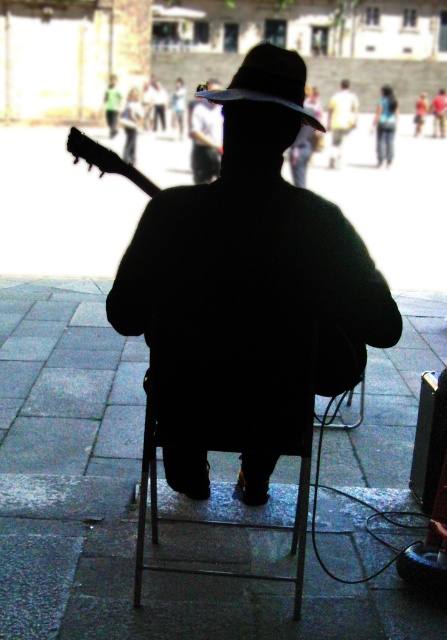
You are a photographer trying to capture the silhouette of the person playing the guitar. You notice the gray concrete pavement at center and the blue denim jeans at upper center in your frame. Which object is positioned lower in the image?

The gray concrete pavement at center is located below the blue denim jeans at upper center, so the gray concrete pavement at center is positioned lower in the image.

You are a photographer trying to capture the silhouette of the person playing the guitar. You want to ensure both the matte black guitar at center and the blue denim jeans at upper center are in focus. Given that your camera can only focus on objects within a 3.5 meter range, will both objects be in focus?

The distance between the matte black guitar at center and the blue denim jeans at upper center is 4.46 meters. Since this exceeds the camera focus range of 3.5 meters, both objects cannot be in focus simultaneously.

You are a photographer trying to capture the scene from the same angle. You notice the matte black guitar at left and the light yellow shirt at center. Which object should you focus on first if you want to capture both in one frame without moving the camera?

The matte black guitar at left is smaller than the light yellow shirt at center, so you should focus on the larger light yellow shirt at center first to ensure it fits within the frame.